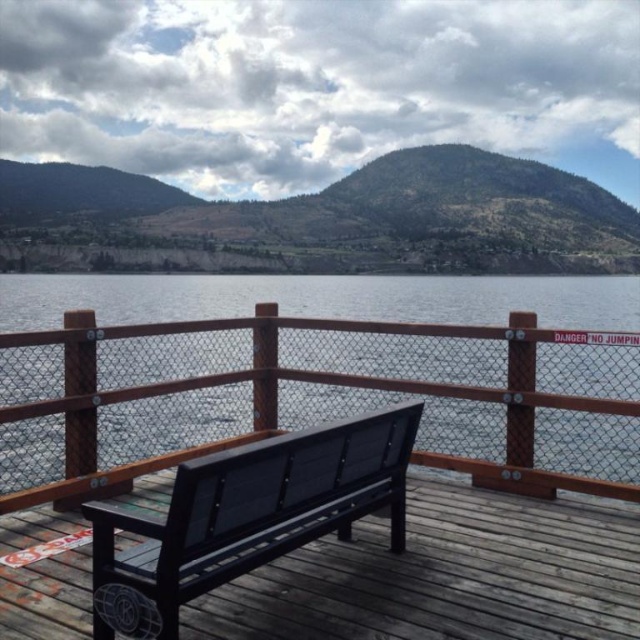
Measure the distance between point (97,339) and camera.

Point (97,339) and camera are 5.09 meters apart from each other.

Is transparent glass water at center closer to camera compared to matte black bench at center?

That is False.

Measure the distance between point (513,477) and camera.

A distance of 17.82 feet exists between point (513,477) and camera.

Where is `transparent glass water at center`? This screenshot has height=640, width=640. transparent glass water at center is located at coordinates (320, 374).